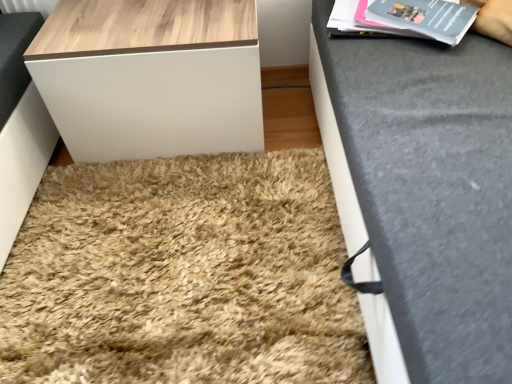
Question: Is wooden table at upper left inside the boundaries of matte gray magazine at upper right, or outside?

Choices:
 (A) inside
 (B) outside

Answer: (B)

Question: Considering the positions of wooden table at upper left and matte gray magazine at upper right in the image, is wooden table at upper left taller or shorter than matte gray magazine at upper right?

Choices:
 (A) tall
 (B) short

Answer: (A)

Question: Which object is the closest to the matte gray magazine at upper right?

Choices:
 (A) wooden table at upper left
 (B) beige shaggy rug at center

Answer: (A)

Question: Which is nearer to the beige shaggy rug at center?

Choices:
 (A) matte gray magazine at upper right
 (B) wooden table at upper left

Answer: (B)